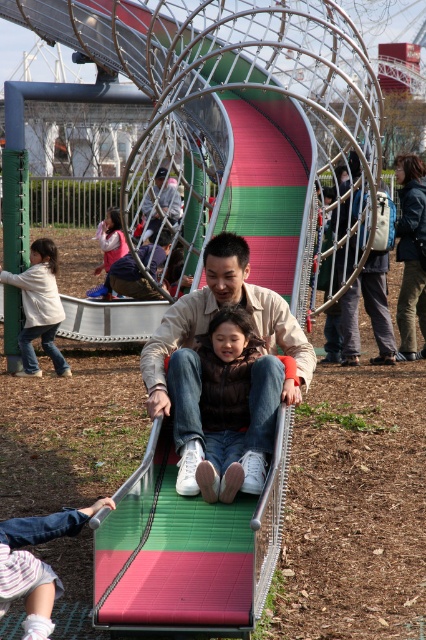
You are observing two shirts in the playground scene. The matte beige shirt at center and the white cotton shirt at left. Which shirt is shorter in height?

The matte beige shirt at center has a lesser height compared to the white cotton shirt at left, so the matte beige shirt at center is shorter.

You are standing at the entrance of the playground and see the matte pink jacket at lower left and the matte silver slide at center. Which object is closer to you?

The matte pink jacket at lower left is closer to you because it is further to the viewer than the matte silver slide at center.